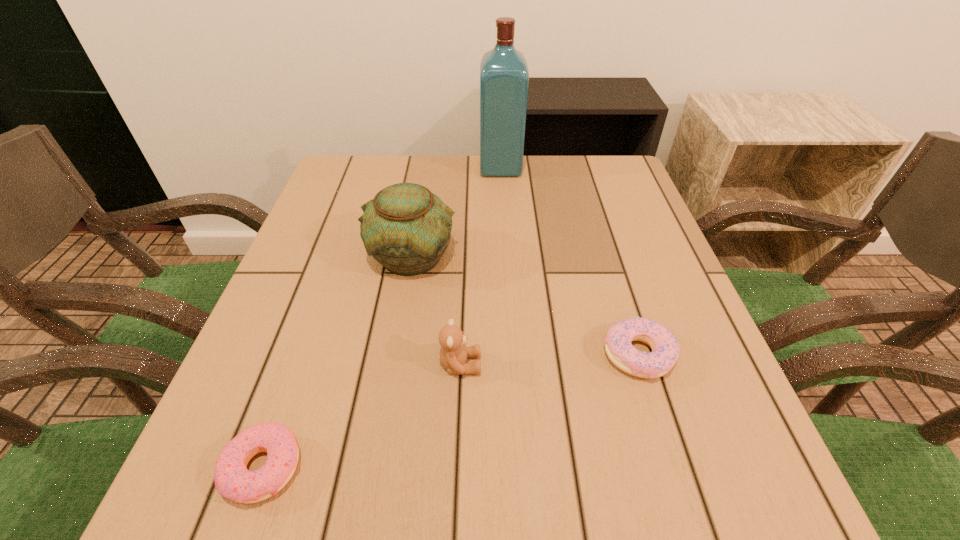
Image resolution: width=960 pixels, height=540 pixels. Identify the location of the farthest object. (504, 77).

Find the location of a particular element. the tallest object is located at coordinates (504, 77).

Find the location of a particular element. The width and height of the screenshot is (960, 540). the fourth shortest object is located at coordinates (406, 228).

Where is `pottery`? Image resolution: width=960 pixels, height=540 pixels. pottery is located at coordinates (406, 228).

Locate an element on the screen. The width and height of the screenshot is (960, 540). teddy bear is located at coordinates (453, 354).

Find the location of a particular element. the rightmost object is located at coordinates (665, 349).

At what (x,y) coordinates should I click in order to perform the action: click on the farther doughnut. Please return your answer as a coordinate pair (x, y). Looking at the image, I should click on (665, 349).

You are a GUI agent. You are given a task and a screenshot of the screen. Output one action in this format:
    pyautogui.click(x=<x>, y=<y>)
    Task: Click on the nearest object
    
    Given the screenshot: What is the action you would take?
    pyautogui.click(x=232, y=479)

At what (x,y) coordinates should I click in order to perform the action: click on the leftmost object. Please return your answer as a coordinate pair (x, y). Looking at the image, I should click on (232, 479).

This screenshot has height=540, width=960. Find the location of `vacant space located 0.290m on the flat label side of the tallest object`. vacant space located 0.290m on the flat label side of the tallest object is located at coordinates (374, 168).